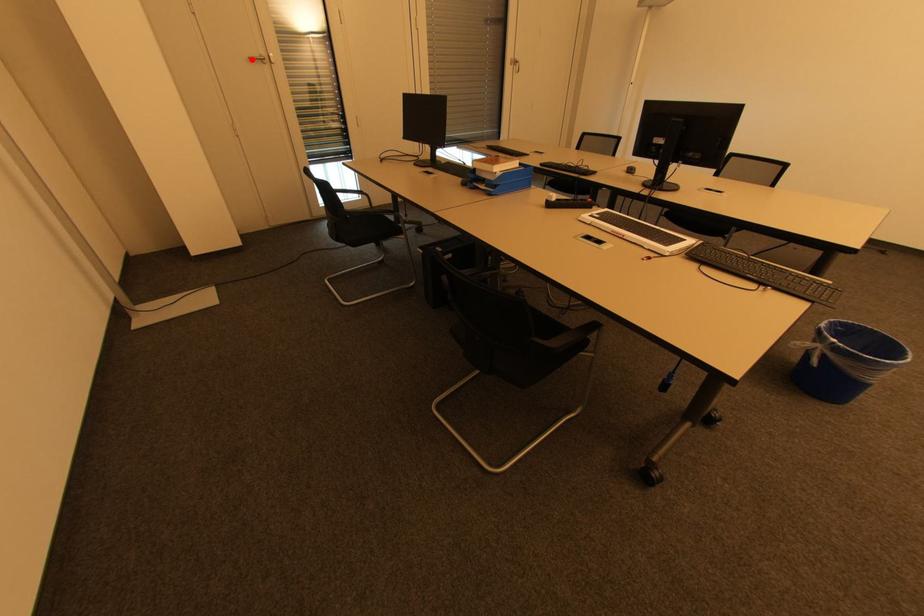
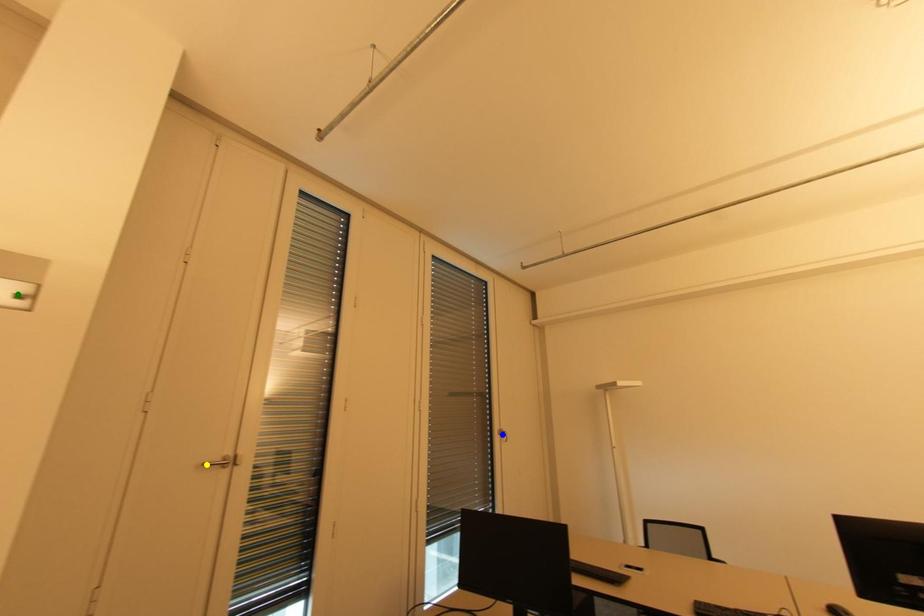
Question: I am providing you with two images of the same scene from different viewpoints. A red point is marked on the first image. You are given multiple points on the second image. Which point in image 2 is actually the same real-world point as the red point in image 1?

Choices:
 (A) yellow point
 (B) green point
 (C) blue point

Answer: (A)